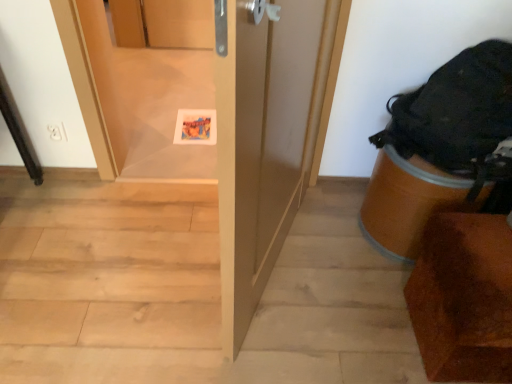
Image resolution: width=512 pixels, height=384 pixels. Find the location of `empty space that is ontop of light wood stairwell at center (from a real-world perspective)`. empty space that is ontop of light wood stairwell at center (from a real-world perspective) is located at coordinates (195, 258).